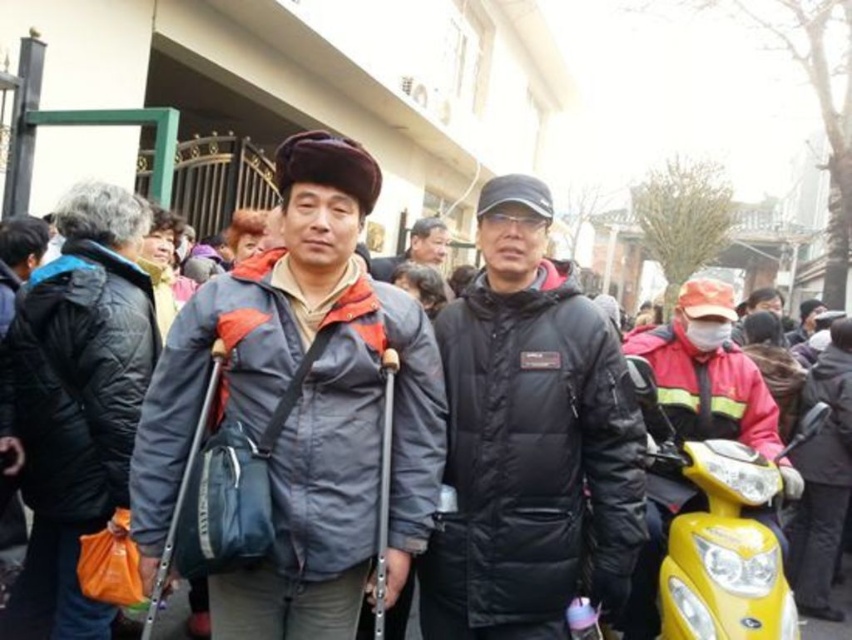
Which is more to the right, black matte jacket at center or yellow matte motorcycle at lower right?

yellow matte motorcycle at lower right is more to the right.

Who is more forward, (452, 346) or (688, 545)?

Point (452, 346) is in front.

At what (x,y) coordinates should I click in order to perform the action: click on black matte jacket at center. Please return your answer as a coordinate pair (x, y). This screenshot has width=852, height=640. Looking at the image, I should click on (528, 438).

Based on the photo, measure the distance between point (756, 540) and camera.

Point (756, 540) is 2.97 meters away from camera.

Is yellow matte motorcycle at lower right behind dark gray puffer jacket at center?

No, yellow matte motorcycle at lower right is closer to the viewer.

Who is more forward, (671, 627) or (436, 236)?

Positioned in front is point (671, 627).

You are a GUI agent. You are given a task and a screenshot of the screen. Output one action in this format:
    pyautogui.click(x=<x>, y=<y>)
    Task: Click on the yellow matte motorcycle at lower right
    
    Given the screenshot: What is the action you would take?
    pyautogui.click(x=707, y=538)

Between black matte jacket at center and dark gray puffer jacket at center, which one appears on the right side from the viewer's perspective?

From the viewer's perspective, black matte jacket at center appears more on the right side.

Who is shorter, black matte jacket at center or dark gray puffer jacket at center?

dark gray puffer jacket at center

Locate an element on the screen. black matte jacket at center is located at coordinates (528, 438).